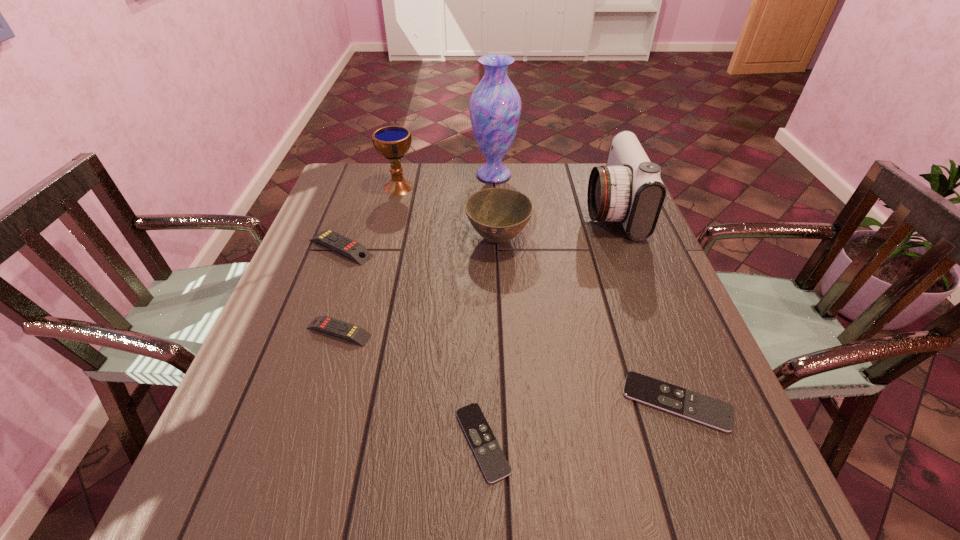
Locate an element on the screen. This screenshot has width=960, height=540. free point located 0.140m on the front of the smaller yellow remote control is located at coordinates (316, 407).

You are a GUI agent. You are given a task and a screenshot of the screen. Output one action in this format:
    pyautogui.click(x=<x>, y=<y>)
    Task: Click on the vacant area situated 0.320m on the back of the second shortest remote control
    This screenshot has height=540, width=960.
    Given the screenshot: What is the action you would take?
    pyautogui.click(x=627, y=266)

The image size is (960, 540). Identify the location of vacant space positioned on the back of the shortest remote control. (482, 277).

Identify the location of vase that is at the far edge. (495, 105).

Where is `camcorder situated at the far edge`? camcorder situated at the far edge is located at coordinates (628, 189).

You are a GUI agent. You are given a task and a screenshot of the screen. Output one action in this format:
    pyautogui.click(x=<x>, y=<y>)
    Task: Click on the chalice that is at the far edge
    
    Given the screenshot: What is the action you would take?
    pyautogui.click(x=392, y=142)

Where is `object that is at the near edge`? object that is at the near edge is located at coordinates (488, 452).

In order to click on chalice located in the left edge section of the desktop in this screenshot , I will do `click(392, 142)`.

This screenshot has height=540, width=960. I want to click on camcorder at the right edge, so point(628,189).

Where is `remote control at the right edge`? This screenshot has width=960, height=540. remote control at the right edge is located at coordinates (706, 410).